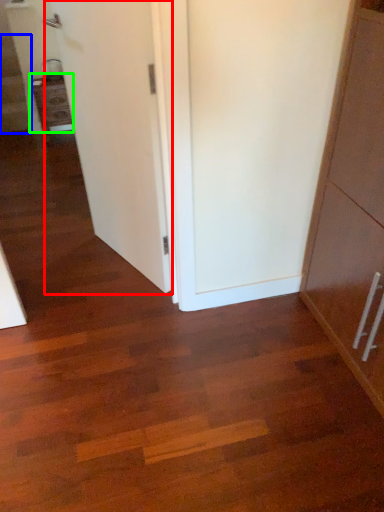
Question: Which object is the farthest from door (highlighted by a red box)? Choose among these: stairwell (highlighted by a blue box) or cabinetry (highlighted by a green box).

Choices:
 (A) stairwell
 (B) cabinetry

Answer: (A)